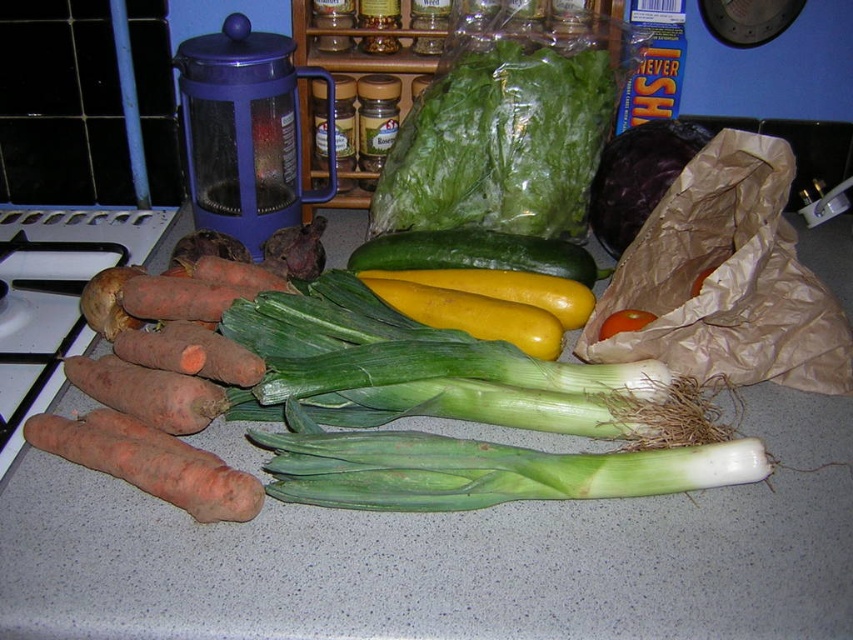
You are a chef preparing a vegetable platter and need to arrange the green smooth skin zucchini at center and the red matte tomato at center on a plate. Based on their positions in the image, which vegetable should you place first to ensure proper spacing?

The green smooth skin zucchini at center is above the red matte tomato at center, so you should place the red matte tomato at center first to allow space for the zucchini above it.

You are a grocery delivery person who just arrived at a customer kitchen. The customer asked you to place a new head of lettuce exactly at point (502, 141). Can you confirm if the current green leafy lettuce at center is already at the correct position?

The green leafy lettuce at center is located at point (502, 141), so yes, the current green leafy lettuce at center is already at the correct position.